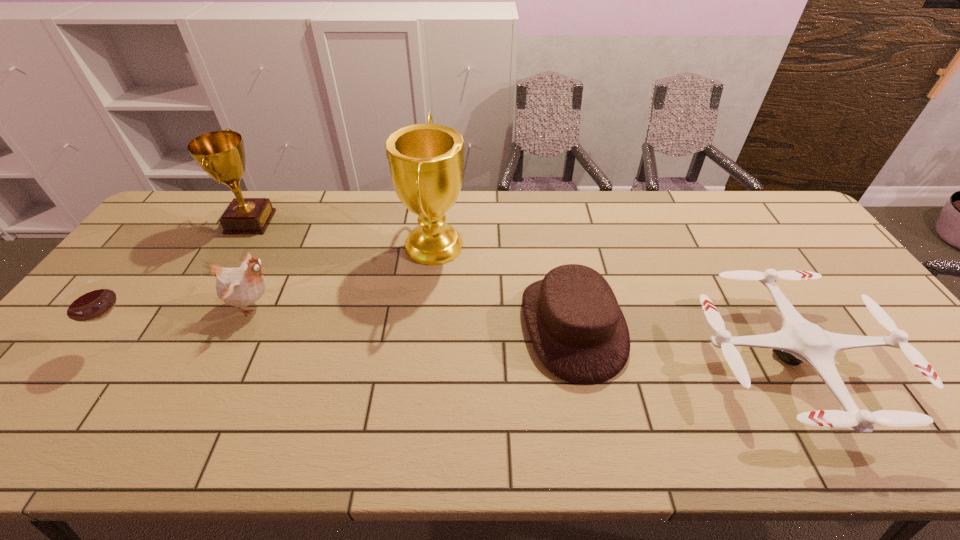
This screenshot has width=960, height=540. I want to click on vacant space situated 0.340m at the beak of the bird, so click(404, 305).

Find the location of `free space located 0.050m on the back of the leftmost object`. free space located 0.050m on the back of the leftmost object is located at coordinates (145, 311).

Find the location of a particular element. Image resolution: width=960 pixels, height=540 pixels. vacant space located 0.180m on the back of the hat is located at coordinates 556,239.

Identify the location of free region located with the camera attached at the bottom of the drone. Image resolution: width=960 pixels, height=540 pixels. (561, 362).

Locate an element on the screen. This screenshot has width=960, height=540. vacant space located 0.280m with the camera attached at the bottom of the drone is located at coordinates (586, 362).

Locate an element on the screen. vacant space situated 0.250m with the camera attached at the bottom of the drone is located at coordinates (597, 362).

You are a GUI agent. You are given a task and a screenshot of the screen. Output one action in this format:
    pyautogui.click(x=<x>, y=<y>)
    Task: Click on the object that is at the near edge
    
    Given the screenshot: What is the action you would take?
    pyautogui.click(x=798, y=341)

This screenshot has width=960, height=540. In order to click on object that is at the left edge in this screenshot , I will do `click(91, 300)`.

Where is `object at the right edge`? object at the right edge is located at coordinates (798, 341).

Identify the location of object that is at the near right corner. (798, 341).